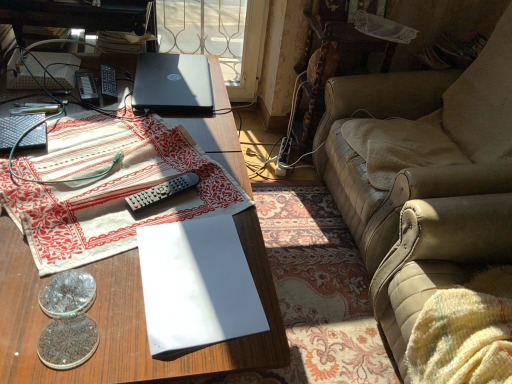
The image size is (512, 384). I want to click on vacant space positioned to the left of gray plastic remote at center, the 3th remote control viewed from the back, so click(x=93, y=188).